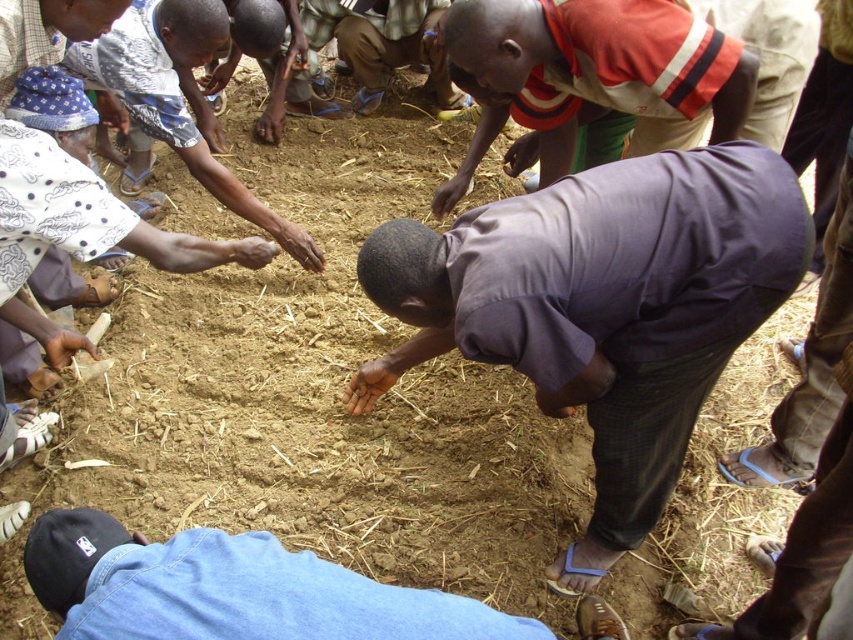
You are a photographer standing at the center of the scene. You want to capture a photo that includes both the blue denim jeans at lower center and the light blue fabric at upper left. What is the minimum distance you need to move backward to ensure both objects are in frame?

The minimum distance you need to move backward is 6.14 feet to include both the blue denim jeans at lower center and the light blue fabric at upper left in the photo.

You are organizing a community gardening event and need to ensure that all participants have enough space to work. You notice two people wearing the purple cotton shirt at center and the red and white striped shirt at center. Which participant requires a wider workspace based on their clothing size?

The purple cotton shirt at center requires a wider workspace because its width is larger than the red and white striped shirt at center.